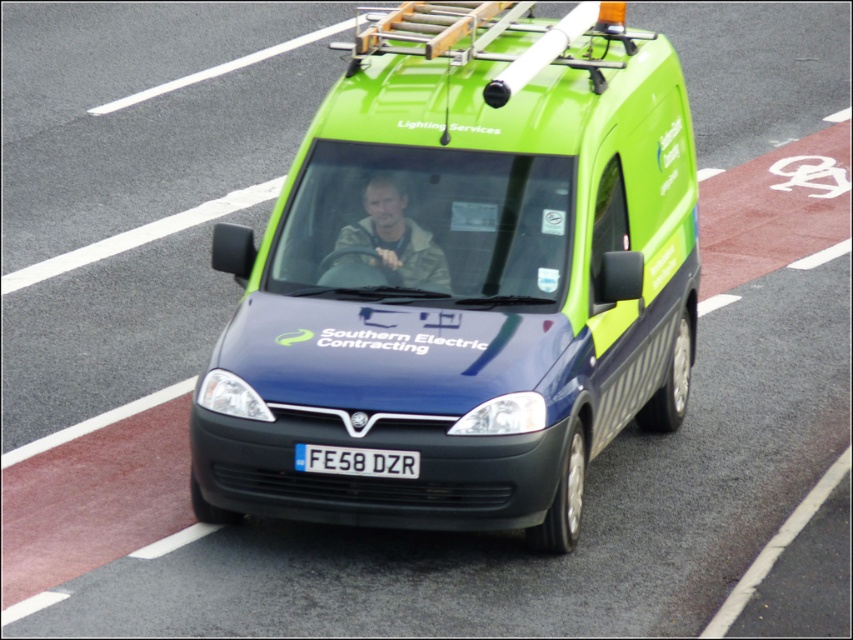
Consider the image. Who is lower down, green matte van at center or camouflage fabric at center?

green matte van at center is below.

Does green matte van at center appear on the right side of camouflage fabric at center?

Indeed, green matte van at center is positioned on the right side of camouflage fabric at center.

Between point (556, 307) and point (363, 280), which one is positioned behind?

Positioned behind is point (363, 280).

The width and height of the screenshot is (853, 640). I want to click on green matte van at center, so click(x=461, y=282).

Is camouflage fabric at center bigger than black plastic license plate at center?

Yes.

How much distance is there between camouflage fabric at center and black plastic license plate at center?

camouflage fabric at center and black plastic license plate at center are 4.02 feet apart.

Which is in front, point (404, 278) or point (418, 470)?

Point (418, 470) is more forward.

In order to click on camouflage fabric at center in this screenshot , I will do `click(386, 244)`.

From the picture: Between green matte van at center and black plastic license plate at center, which one is positioned lower?

black plastic license plate at center is lower down.

Does point (585, 205) come farther from viewer compared to point (384, 464)?

That is True.

Is point (282, 474) farther from viewer compared to point (415, 477)?

Yes, it is.

This screenshot has width=853, height=640. Find the location of `green matte van at center`. green matte van at center is located at coordinates (461, 282).